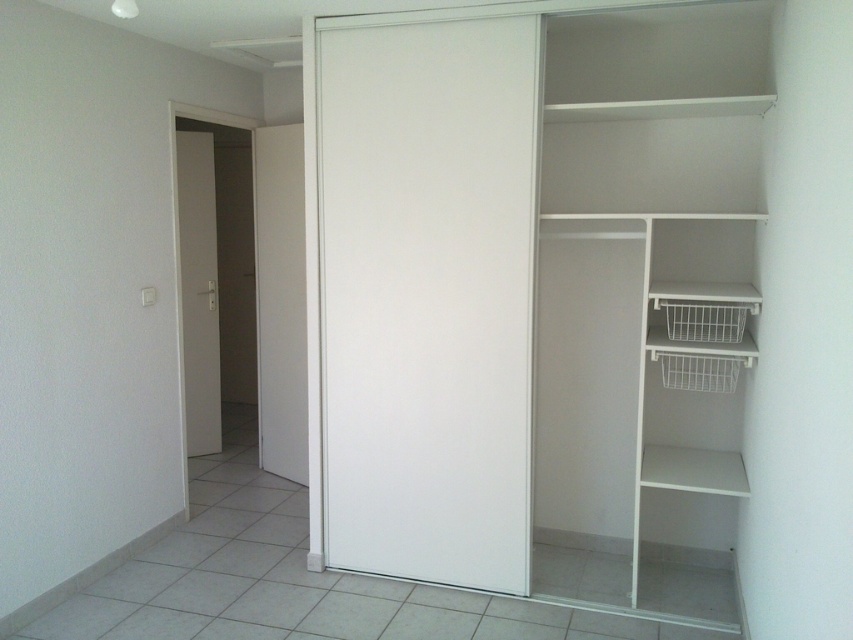
Can you confirm if white matte closet at center is smaller than white matte door at left?

Incorrect, white matte closet at center is not smaller in size than white matte door at left.

Does white matte closet at center appear under white matte door at left?

Yes, white matte closet at center is below white matte door at left.

Is point (630, 92) farther from viewer compared to point (194, 180)?

No.

Locate an element on the screen. This screenshot has width=853, height=640. white matte closet at center is located at coordinates (540, 296).

Can you confirm if white matte closet at center is positioned above white smooth door at left?

Yes.

Can you confirm if white matte closet at center is positioned below white smooth door at left?

Incorrect, white matte closet at center is not positioned below white smooth door at left.

What do you see at coordinates (540, 296) in the screenshot? Image resolution: width=853 pixels, height=640 pixels. I see `white matte closet at center` at bounding box center [540, 296].

Locate an element on the screen. white matte closet at center is located at coordinates (540, 296).

Between white matte closet at center and white matte sliding door at center, which one is positioned higher?

white matte closet at center

Is point (708, 424) closer to camera compared to point (502, 61)?

That is False.

Locate an element on the screen. This screenshot has width=853, height=640. white matte closet at center is located at coordinates (540, 296).

Locate an element on the screen. The width and height of the screenshot is (853, 640). white matte closet at center is located at coordinates (540, 296).